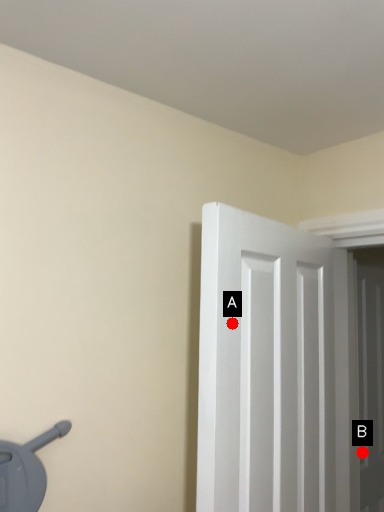
Question: Two points are circled on the image, labeled by A and B beside each circle. Among these points, which one is nearest to the camera?

Choices:
 (A) A is closer
 (B) B is closer

Answer: (A)